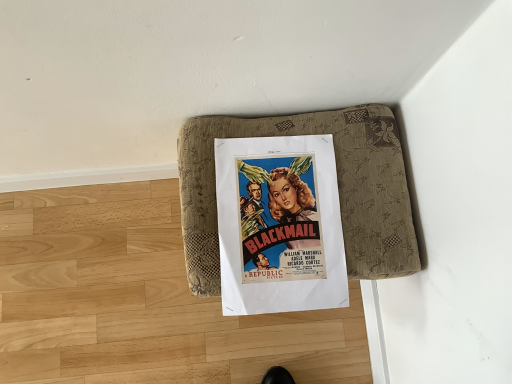
Find the location of a particular element. This screenshot has height=384, width=512. vibrant paper poster at center is located at coordinates (279, 225).

What do you see at coordinates (279, 225) in the screenshot? I see `vibrant paper poster at center` at bounding box center [279, 225].

Locate an element on the screen. vibrant paper poster at center is located at coordinates click(279, 225).